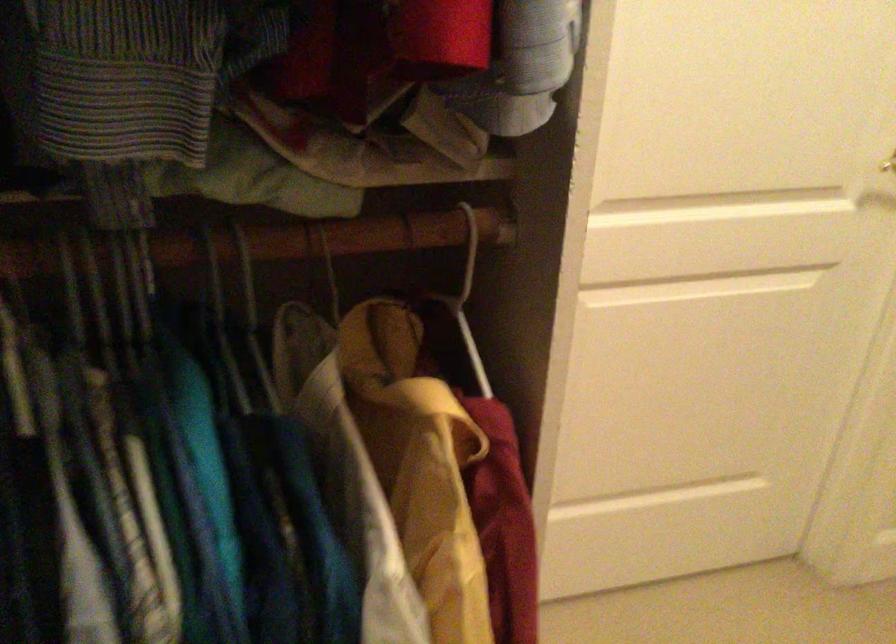
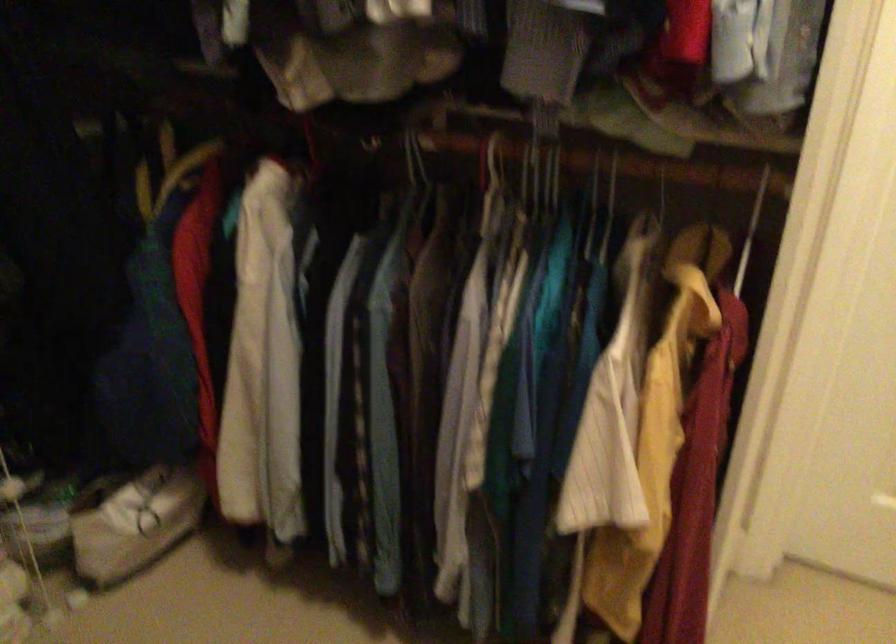
In the second image, find the point that corresponds to pixel 380 274 in the first image.

(751, 230)